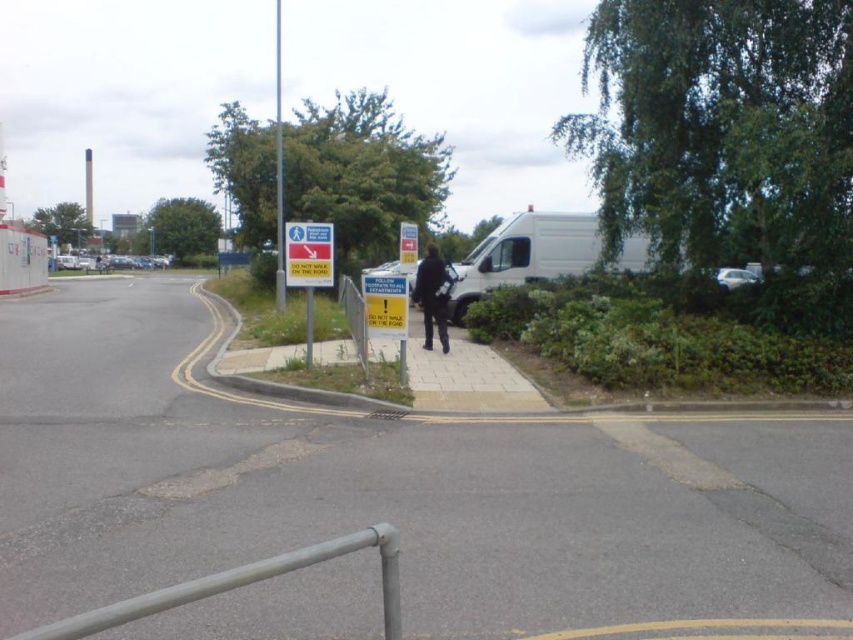
You are a delivery robot with a 1.5 meter wide package. You need to navigate between the blue plastic sign at center and the dark blue jacket at center. Can you fit through the space between them?

The blue plastic sign at center and dark blue jacket at center are 2.57 meters apart from each other. Since your package is 1.5 meters wide, you can fit through the space between them as the distance is wider than the package.

You are driving a car that is 15 feet long and need to park it between the yellow plastic sign at center and the metallic silver car at right. Is there enough space between them to park your car?

The yellow plastic sign at center and metallic silver car at right are 26.83 feet apart. Since your car is 15 feet long, there is sufficient space between them to park your car.